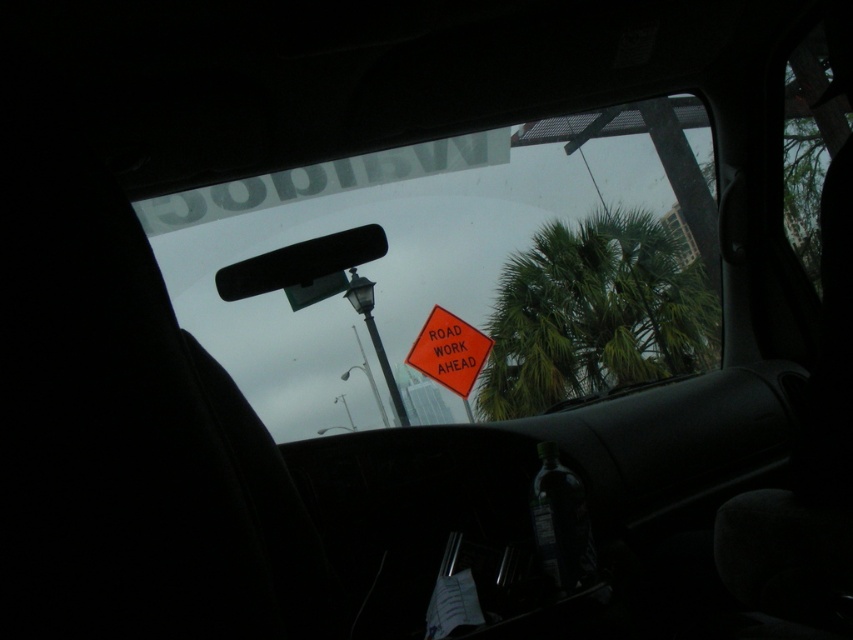
Question: Does orange diamond-shaped sign at center appear over green leafy palm tree at center?

Choices:
 (A) yes
 (B) no

Answer: (A)

Question: Estimate the real-world distances between objects in this image. Which object is closer to the green leafy palm tree at center?

Choices:
 (A) orange diamond-shaped sign at center
 (B) orange reflective road sign at center

Answer: (A)

Question: Which object is positioned closest to the orange reflective road sign at center?

Choices:
 (A) orange diamond-shaped sign at center
 (B) green leafy palm tree at center

Answer: (A)

Question: Which object is the closest to the orange reflective road sign at center?

Choices:
 (A) green leafy palm tree at center
 (B) orange diamond-shaped sign at center

Answer: (B)

Question: Does orange diamond-shaped sign at center have a smaller size compared to green leafy palm tree at center?

Choices:
 (A) yes
 (B) no

Answer: (B)

Question: Where is orange diamond-shaped sign at center located in relation to green leafy palm tree at center in the image?

Choices:
 (A) left
 (B) right

Answer: (A)